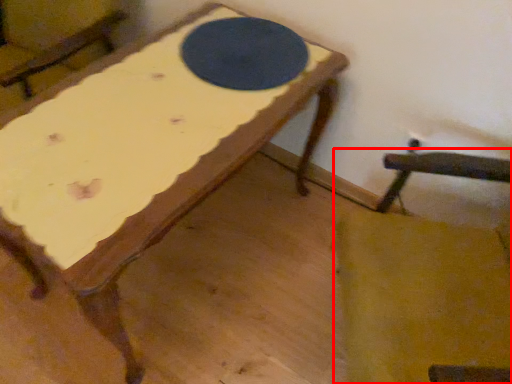
Question: Where is rocking chair (annotated by the red box) located in relation to table tennis table in the image?

Choices:
 (A) left
 (B) right

Answer: (B)